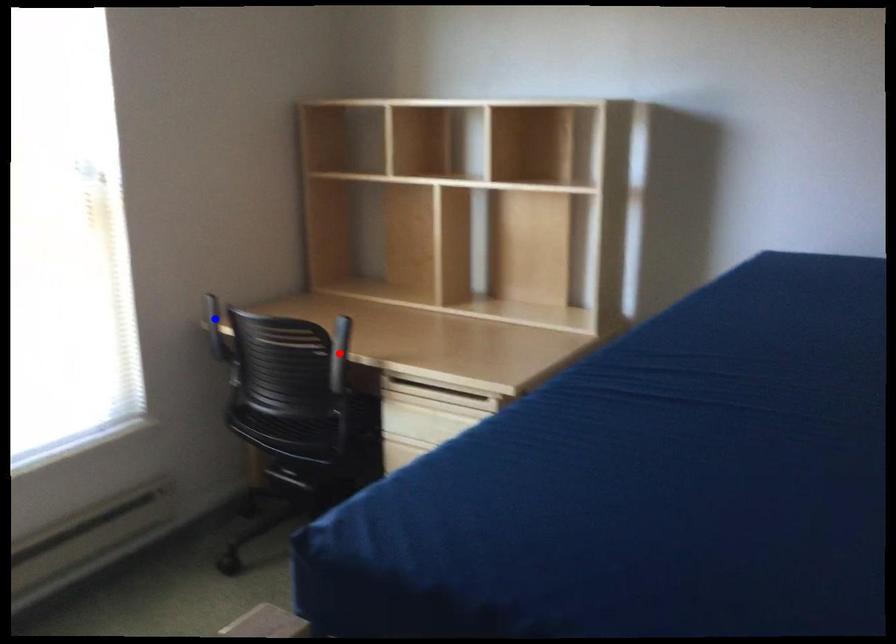
Question: In the image, two points are highlighted. Which point is nearer to the camera? Reply with the corresponding letter.

Choices:
 (A) blue point
 (B) red point

Answer: (A)